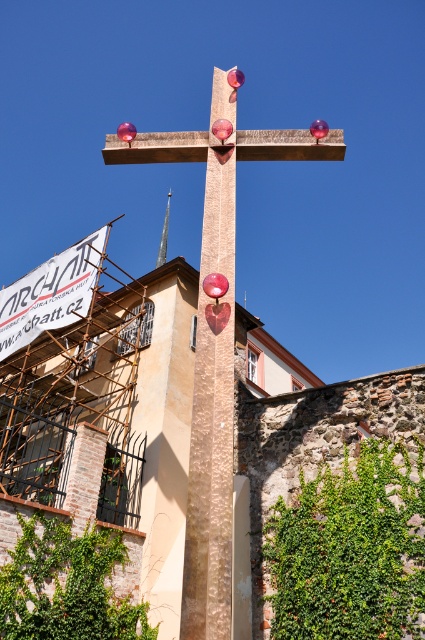
Who is more distant from viewer, [175,141] or [159,244]?

The point [159,244] is more distant.

Between wooden cross at center and silver metallic spire at center, which one is positioned lower?

silver metallic spire at center

Who is more forward, (198, 593) or (158, 259)?

Point (198, 593) is in front.

Where is `wooden cross at center`? wooden cross at center is located at coordinates (217, 336).